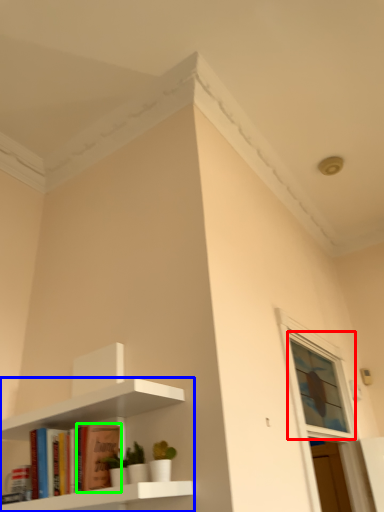
Question: Based on their relative distances, which object is nearer to window (highlighted by a red box)? Choose from shelf (highlighted by a blue box) and book (highlighted by a green box).

Choices:
 (A) shelf
 (B) book

Answer: (A)